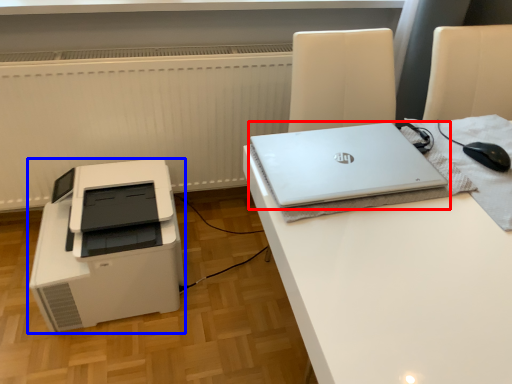
Question: Which of the following is the farthest to the observer, laptop (highlighted by a red box) or printer (highlighted by a blue box)?

Choices:
 (A) laptop
 (B) printer

Answer: (B)